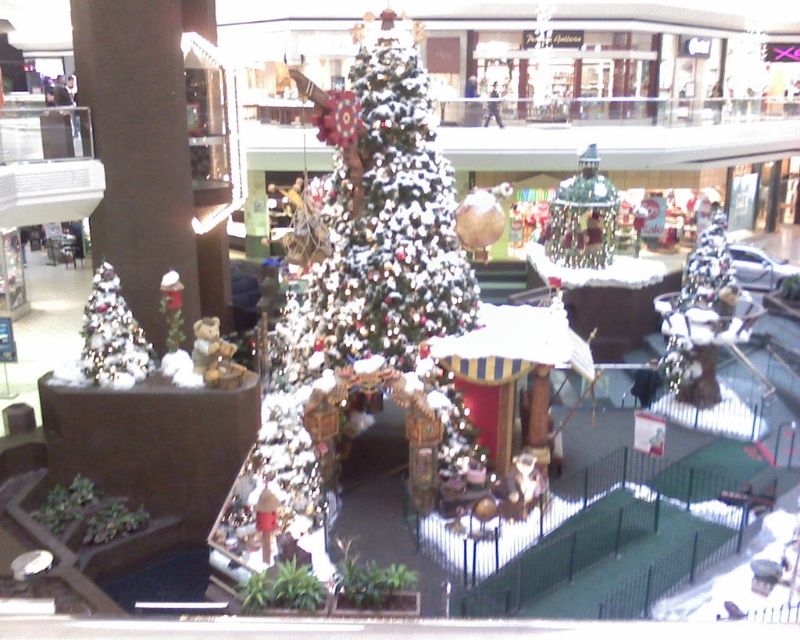
You are a visitor at the mall and see the metallic silver ornament at center and the white glittery christmas tree at lower left. Which object is located to the right of the other?

The metallic silver ornament at center is positioned on the right side of white glittery christmas tree at lower left.

You are standing in front of the Christmas display at the mall and notice two points marked in the scene. One is at coordinate point (558, 195) and the other is at point (104, 376). Which point is closer to you?

Point (104, 376) is closer to you because it is less further to the camera than point (558, 195).

In the scene shown: You are a visitor at the mall and want to take a photo of the metallic silver ornament at center and the white glittery christmas tree at lower left. Which object should you focus on first if you want to capture both in the same frame without moving your camera?

The metallic silver ornament at center is taller than the white glittery christmas tree at lower left, so you should focus on the metallic silver ornament at center first to ensure both fit in the frame.